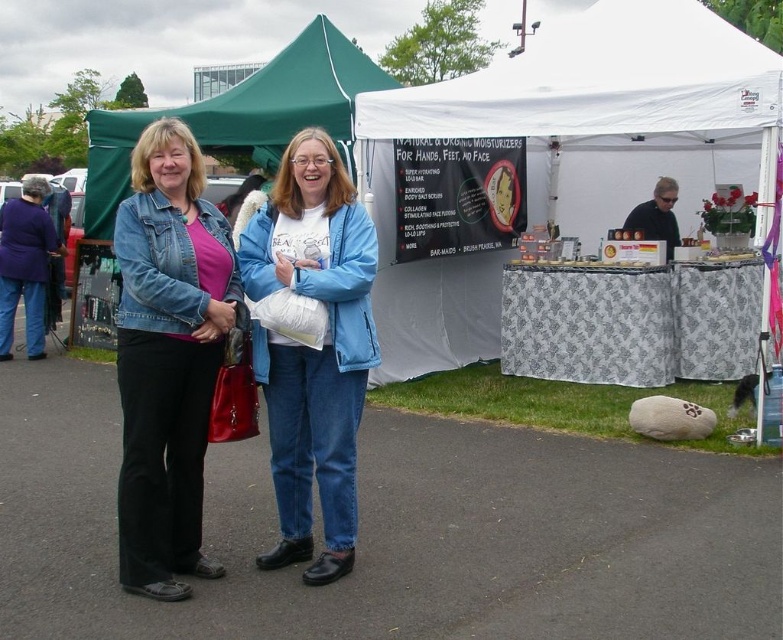
Does green fabric canopy at upper center appear under denim jacket at left?

No, green fabric canopy at upper center is not below denim jacket at left.

Which of these two, green fabric canopy at upper center or denim jacket at left, stands shorter?

With less height is denim jacket at left.

Which is in front, point (197, 129) or point (2, 241)?

Point (197, 129) is in front.

Where is `green fabric canopy at upper center`? This screenshot has height=640, width=783. green fabric canopy at upper center is located at coordinates (240, 115).

Does white fabric tent at upper center come behind blue denim jacket at center?

Yes, white fabric tent at upper center is further from the viewer.

Is point (365, 122) closer to viewer compared to point (334, 248)?

No, (365, 122) is behind (334, 248).

Where is `white fabric tent at upper center`? The width and height of the screenshot is (783, 640). white fabric tent at upper center is located at coordinates (565, 150).

Can you confirm if blue denim jacket at center is wider than matte black shirt at upper center?

No, blue denim jacket at center is not wider than matte black shirt at upper center.

Who is positioned more to the left, blue denim jacket at center or matte black shirt at upper center?

blue denim jacket at center

Is point (290, 280) farther from viewer compared to point (644, 209)?

No, (290, 280) is in front of (644, 209).

This screenshot has height=640, width=783. What are the coordinates of `blue denim jacket at center` in the screenshot? It's located at (312, 348).